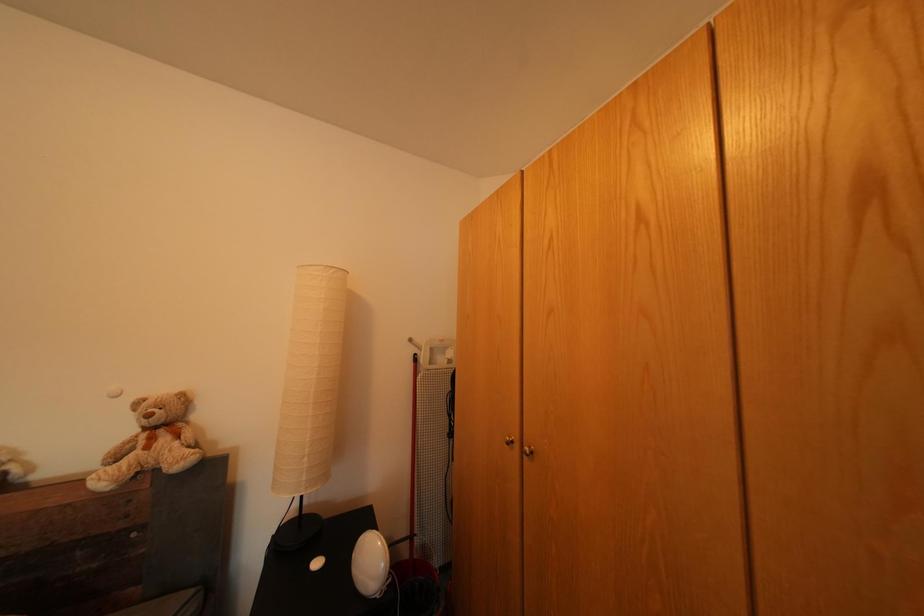
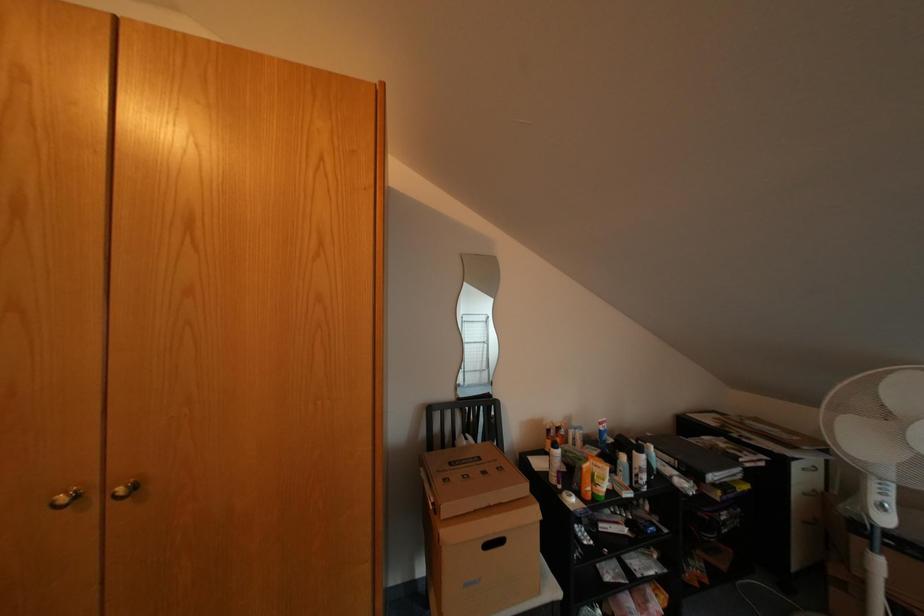
Question: The camera is either moving clockwise (left) or counter-clockwise (right) around the object. The first image is from the beginning of the video and the second image is from the end. Is the camera moving left or right when shooting the video?

Choices:
 (A) Left
 (B) Right

Answer: (A)